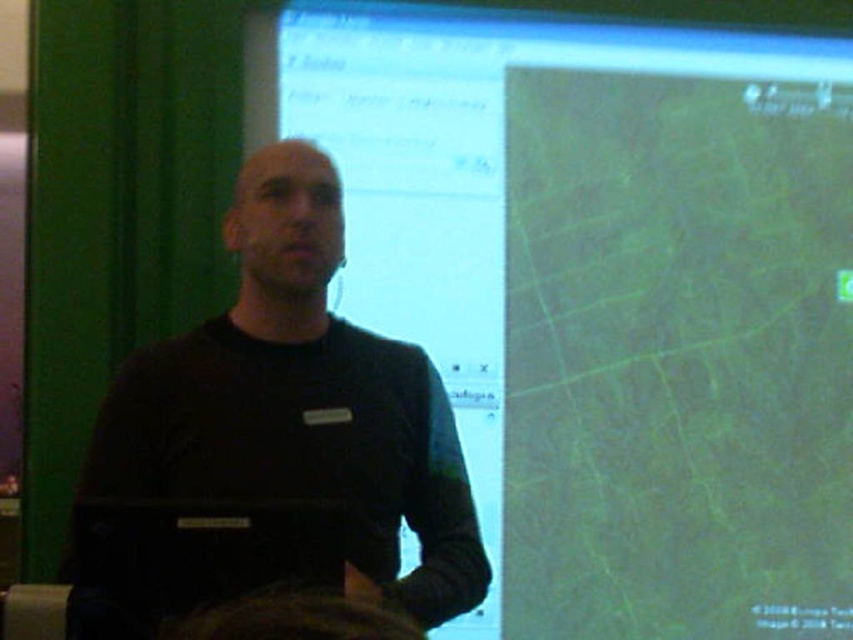
You are an attendee at a presentation and need to take a photo of both the green matte map at center and the black matte laptop at center. The camera you have can only focus on objects within a 25 inch range. Can you capture both objects in one shot without moving the camera?

The green matte map at center and the black matte laptop at center are 28.02 inches apart from each other. Since the camera can only focus within a 25 inch range, the distance between them exceeds this limit. Therefore, you cannot capture both objects in one shot without moving the camera.

You are an attendee at a presentation and want to focus on the black matte laptop at center being shown by the presenter. However, the green matte map at center is blocking your view. Can you move closer to see the laptop better?

The green matte map at center is further to the viewer than the black matte laptop at center, so moving closer would bring both objects into better focus. However, since the map is closer to you, moving forward might reduce the obstruction as the distance between you and the laptop decreases, allowing a clearer view around the map.

You are an attendee at a presentation and need to take a photo of both the green matte map at center and the black matte laptop at center. Which object should you focus on first if you want to capture both in one frame without moving your camera?

The black matte laptop at center should be focused on first since the green matte map at center is to the right of it, allowing both to be captured in one frame by centering the laptop and including the map to its right.